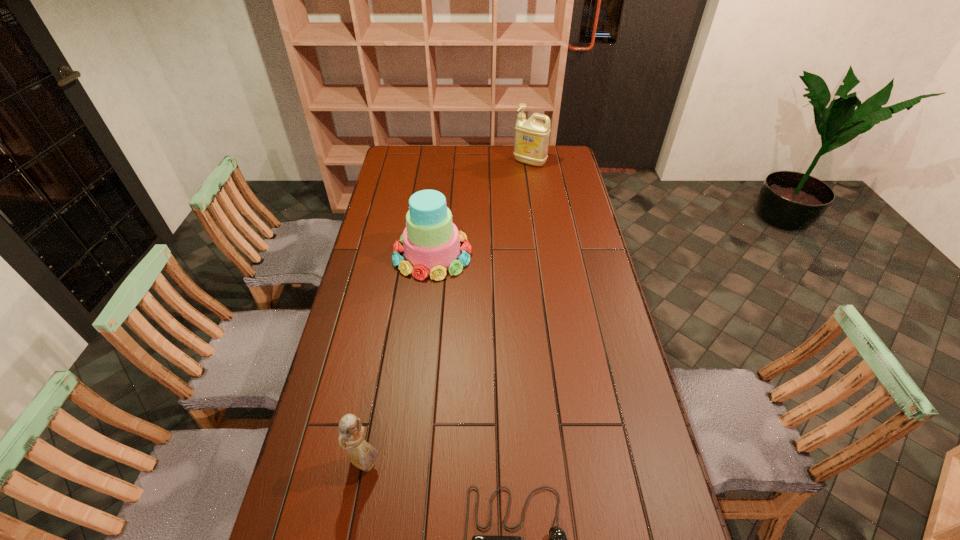
Image resolution: width=960 pixels, height=540 pixels. Identify the location of object that is at the right edge. (531, 142).

Where is `object positioned at the far right corner`? Image resolution: width=960 pixels, height=540 pixels. object positioned at the far right corner is located at coordinates (531, 142).

In the image, there is a desktop. Where is `free space at the far edge`? The height and width of the screenshot is (540, 960). free space at the far edge is located at coordinates (422, 154).

At what (x,y) coordinates should I click in order to perform the action: click on vacant region at the left edge of the desktop. Please return your answer as a coordinate pair (x, y). Looking at the image, I should click on (380, 259).

In the image, there is a desktop. Identify the location of vacant space at the right edge. (603, 276).

At what (x,y) coordinates should I click in order to perform the action: click on free space between the detergent and the third farthest object. Please return your answer as a coordinate pair (x, y). Image resolution: width=960 pixels, height=540 pixels. Looking at the image, I should click on (447, 313).

Find the location of `vacant space in between the cake and the farthest object`. vacant space in between the cake and the farthest object is located at coordinates (481, 208).

You are a GUI agent. You are given a task and a screenshot of the screen. Output one action in this format:
    pyautogui.click(x=<x>, y=<y>)
    Task: Click on the unoccupied position between the cake and the second nearest object
    The height and width of the screenshot is (540, 960).
    Given the screenshot: What is the action you would take?
    pyautogui.click(x=399, y=359)

Find the location of a particular element. This screenshot has width=960, height=540. empty space between the cake and the detergent is located at coordinates (481, 208).

The height and width of the screenshot is (540, 960). In order to click on vacant point located between the third tallest object and the third nearest object in this screenshot , I will do `click(399, 359)`.